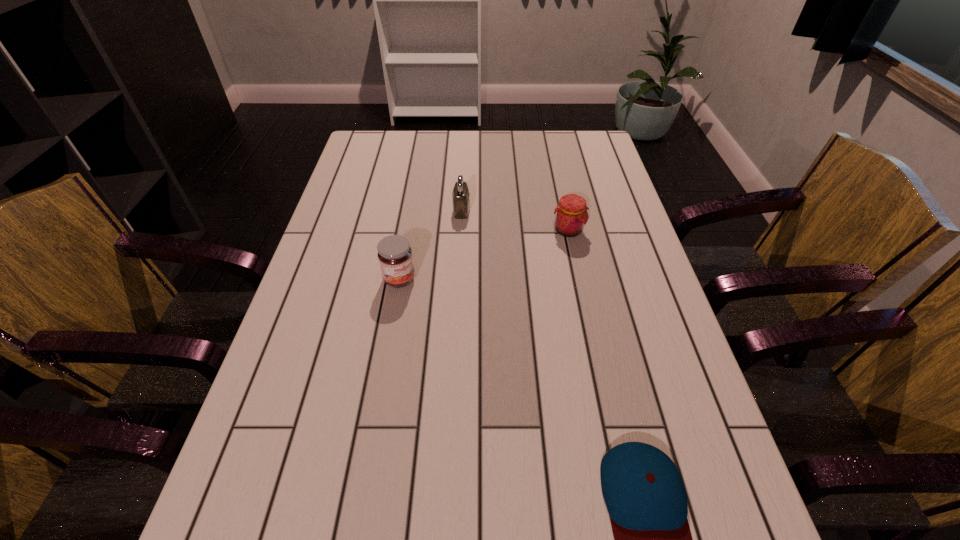
Where is `vacant space at the far edge of the desktop`? vacant space at the far edge of the desktop is located at coordinates (486, 141).

The height and width of the screenshot is (540, 960). Identify the location of free space at the left edge of the desktop. (319, 463).

Image resolution: width=960 pixels, height=540 pixels. In order to click on vacant space at the right edge of the desktop in this screenshot , I will do `click(607, 197)`.

Identify the location of vacant area at the far left corner. This screenshot has height=540, width=960. (361, 143).

Locate an element on the screen. This screenshot has width=960, height=540. vacant space at the far right corner of the desktop is located at coordinates (575, 143).

Image resolution: width=960 pixels, height=540 pixels. I want to click on vacant space in between the shorter jam and the nearer jam, so click(484, 255).

Locate an element on the screen. free space that is in between the left jam and the second object from left to right is located at coordinates [x=430, y=245].

Identify the location of vacant point located between the right jam and the leftmost object. (484, 255).

Locate an element on the screen. free point between the farther jam and the third object from right to left is located at coordinates (515, 220).

Locate which object is the closest to the third farthest object. Please provide its 2D coordinates. Your answer should be formatted as a tuple, i.e. [(x, y)], where the tuple contains the x and y coordinates of a point satisfying the conditions above.

[(460, 196)]